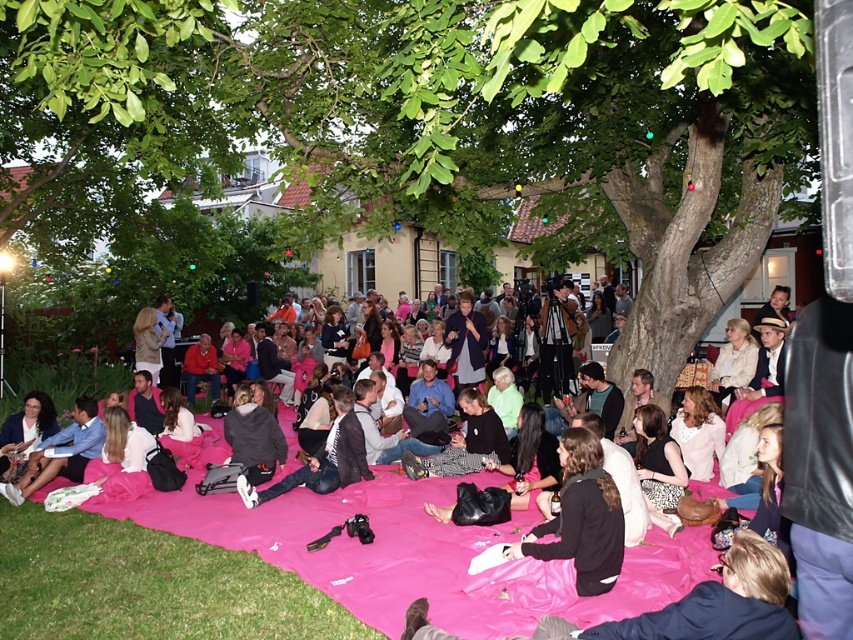
Question: Considering the relative positions of green leafy tree at upper center and pink fabric blanket at center in the image provided, where is green leafy tree at upper center located with respect to pink fabric blanket at center?

Choices:
 (A) left
 (B) right

Answer: (A)

Question: Is pink fabric blanket at center further to camera compared to dark gray jacket at center?

Choices:
 (A) yes
 (B) no

Answer: (B)

Question: Among these points, which one is farthest from the camera?

Choices:
 (A) (241, 497)
 (B) (643, 548)
 (C) (47, 460)
 (D) (357, 147)

Answer: (D)

Question: Which point appears closest to the camera in this image?

Choices:
 (A) (16, 497)
 (B) (183, 621)
 (C) (90, 177)

Answer: (B)

Question: Can you confirm if green leafy tree at upper center is positioned above dark gray jacket at center?

Choices:
 (A) yes
 (B) no

Answer: (A)

Question: Which of the following is the farthest from the observer?

Choices:
 (A) (799, 42)
 (B) (357, 436)
 (C) (196, 608)

Answer: (B)